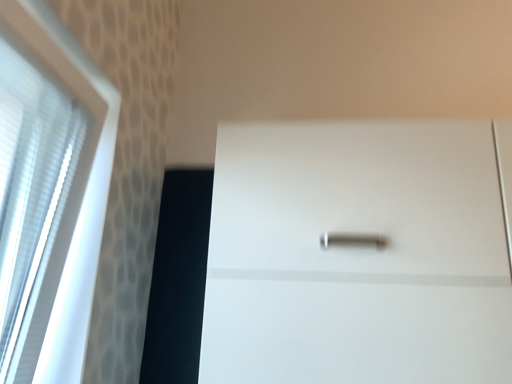
Identify the location of white matte cabinet handle at center. (357, 256).

In order to face white matte cabinet handle at center, should I rotate leftwards or rightwards?

You should rotate right by 16.775 degrees.

Describe the element at coordinates (357, 256) in the screenshot. The height and width of the screenshot is (384, 512). I see `white matte cabinet handle at center` at that location.

The width and height of the screenshot is (512, 384). In order to click on white matte cabinet handle at center in this screenshot , I will do `click(357, 256)`.